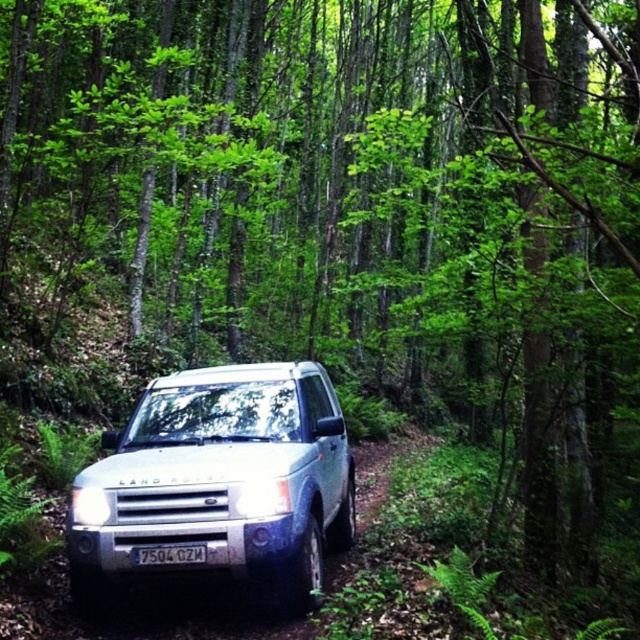
Question: Which of the following is the farthest from the observer?

Choices:
 (A) (154, 550)
 (B) (106, 477)

Answer: (B)

Question: Does silver metallic suv at center have a larger size compared to white plastic license plate at center?

Choices:
 (A) yes
 (B) no

Answer: (A)

Question: Which point appears farthest from the camera in this image?

Choices:
 (A) (166, 563)
 (B) (196, 428)

Answer: (B)

Question: Is silver metallic suv at center to the left of white plastic license plate at center from the viewer's perspective?

Choices:
 (A) yes
 (B) no

Answer: (B)

Question: Where is silver metallic suv at center located in relation to white plastic license plate at center in the image?

Choices:
 (A) above
 (B) below

Answer: (A)